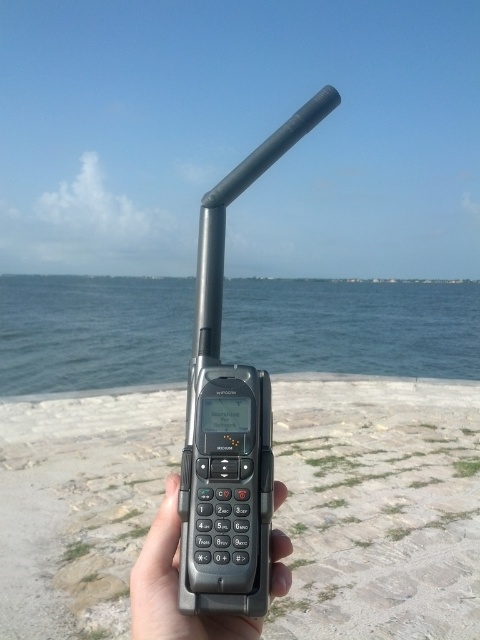
Question: Does blue water at center appear under black plastic phone at center?

Choices:
 (A) yes
 (B) no

Answer: (B)

Question: Estimate the real-world distances between objects in this image. Which object is closer to the blue water at center?

Choices:
 (A) black plastic phone at center
 (B) gray stone beach at center
 (C) black matte phone at center
 (D) black matte antenna at center

Answer: (B)

Question: Considering the real-world distances, which object is farthest from the gray stone beach at center?

Choices:
 (A) blue water at center
 (B) black matte phone at center

Answer: (A)

Question: Is gray stone beach at center wider than black matte antenna at center?

Choices:
 (A) yes
 (B) no

Answer: (A)

Question: Does gray stone beach at center appear under black plastic phone at center?

Choices:
 (A) no
 (B) yes

Answer: (B)

Question: Estimate the real-world distances between objects in this image. Which object is closer to the gray stone beach at center?

Choices:
 (A) blue water at center
 (B) black matte antenna at center
 (C) black matte phone at center
 (D) black plastic phone at center

Answer: (D)